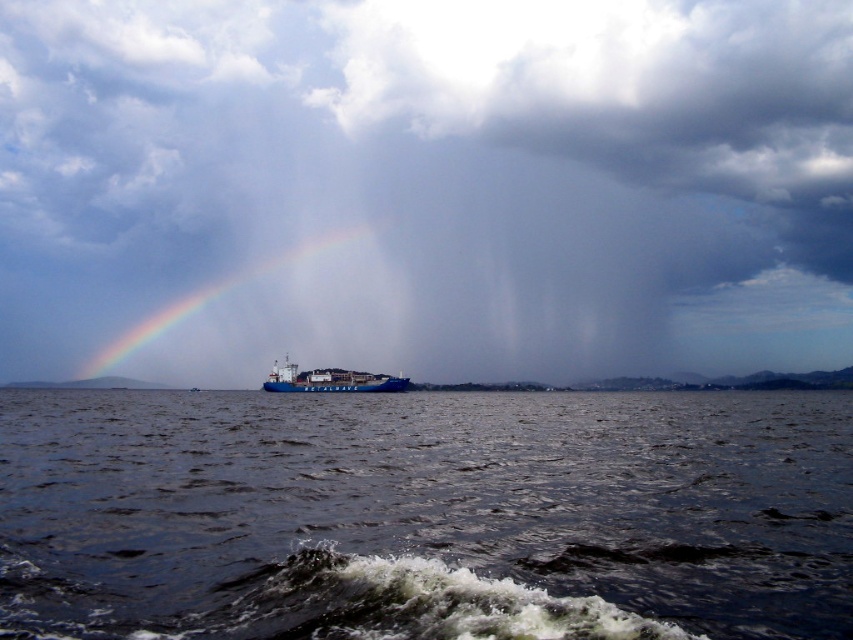
Question: Does dark blue water at center have a smaller size compared to rainbow at center?

Choices:
 (A) yes
 (B) no

Answer: (B)

Question: Estimate the real-world distances between objects in this image. Which object is closer to the rainbow at center?

Choices:
 (A) blue matte cargo ship at center
 (B) dark blue water at center

Answer: (A)

Question: Is dark blue water at center positioned before blue matte cargo ship at center?

Choices:
 (A) no
 (B) yes

Answer: (B)

Question: Does cloudy textured sky at center come in front of blue matte cargo ship at center?

Choices:
 (A) yes
 (B) no

Answer: (B)

Question: Among these objects, which one is nearest to the camera?

Choices:
 (A) cloudy textured sky at center
 (B) blue matte cargo ship at center
 (C) dark blue water at center

Answer: (C)

Question: Considering the real-world distances, which object is closest to the blue matte cargo ship at center?

Choices:
 (A) cloudy textured sky at center
 (B) dark blue water at center
 (C) rainbow at center

Answer: (B)